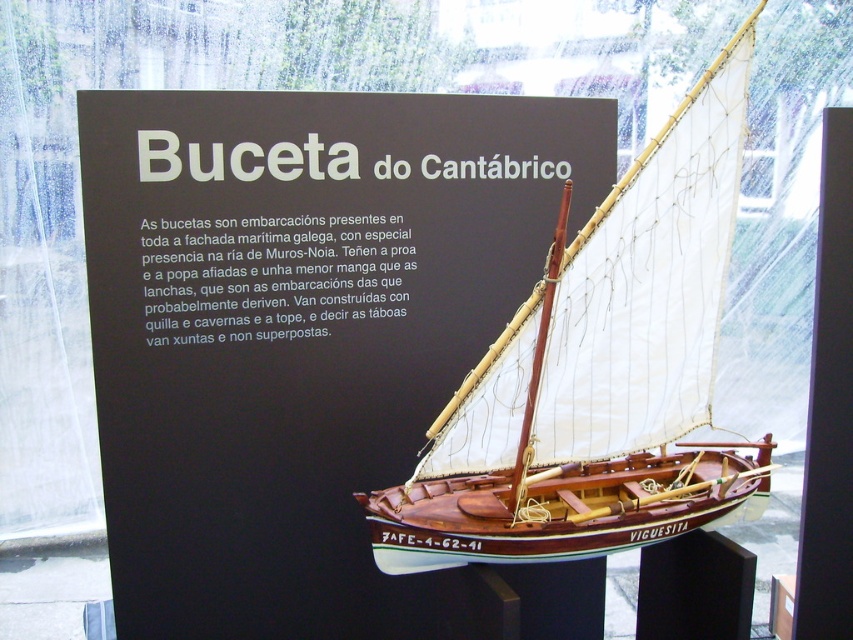
Question: Where is matte wood sign at center located in relation to wooden sailboat at center in the image?

Choices:
 (A) above
 (B) below

Answer: (A)

Question: Considering the relative positions of matte wood sign at center and wooden sailboat at center in the image provided, where is matte wood sign at center located with respect to wooden sailboat at center?

Choices:
 (A) right
 (B) left

Answer: (B)

Question: Is matte wood sign at center to the right of wooden sailboat at center from the viewer's perspective?

Choices:
 (A) yes
 (B) no

Answer: (B)